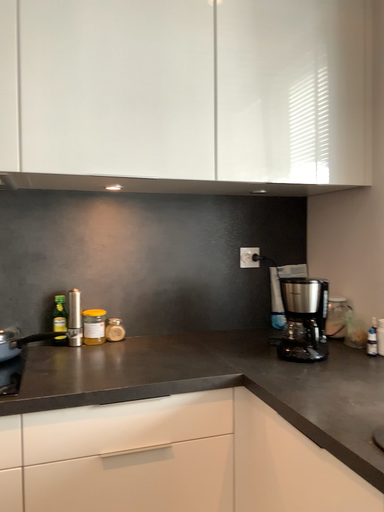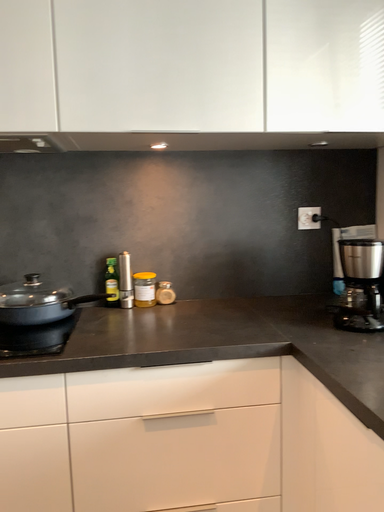
Question: How did the camera likely rotate when shooting the video?

Choices:
 (A) rotated left
 (B) rotated right

Answer: (A)